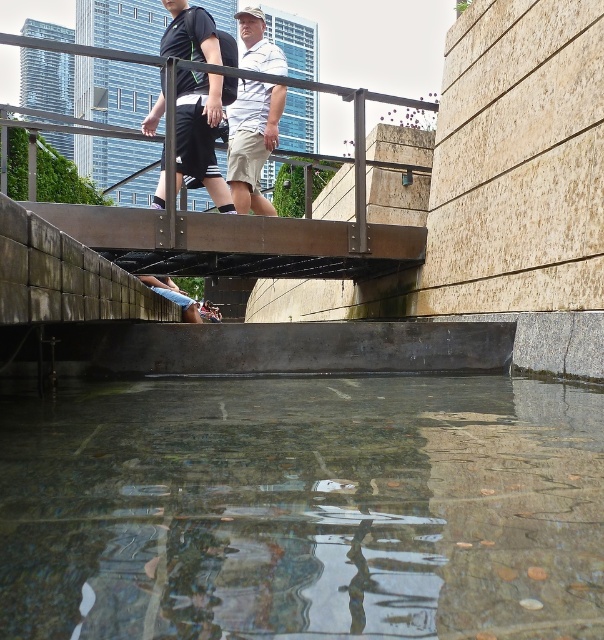
Question: Is clear glass water at lower center wider than black matte shorts at center?

Choices:
 (A) no
 (B) yes

Answer: (B)

Question: Is clear glass water at lower center below white matte shirt at center?

Choices:
 (A) no
 (B) yes

Answer: (B)

Question: Which point is farther from the camera taking this photo?

Choices:
 (A) (234, 131)
 (B) (472, 636)

Answer: (A)

Question: Does black matte shorts at center have a lesser width compared to white matte shirt at center?

Choices:
 (A) no
 (B) yes

Answer: (B)

Question: Among these points, which one is nearest to the camera?

Choices:
 (A) (181, 134)
 (B) (239, 112)

Answer: (A)

Question: Which point is farther from the camera taking this photo?

Choices:
 (A) (410, 561)
 (B) (269, 86)
 (C) (213, 28)

Answer: (B)